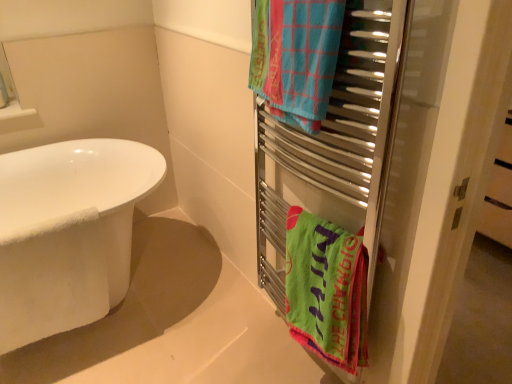
Find the location of a particular element. vacant space situated above green fabric towel at right, the 2th towel/napkin in the top-to-bottom sequence (from a real-world perspective) is located at coordinates (319, 227).